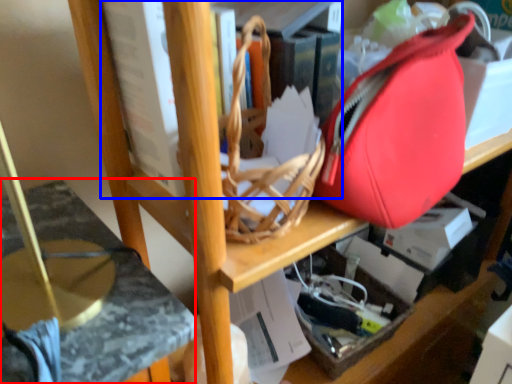
Question: Among these objects, which one is nearest to the camera, swivel chair (highlighted by a red box) or book (highlighted by a blue box)?

Choices:
 (A) swivel chair
 (B) book

Answer: (A)